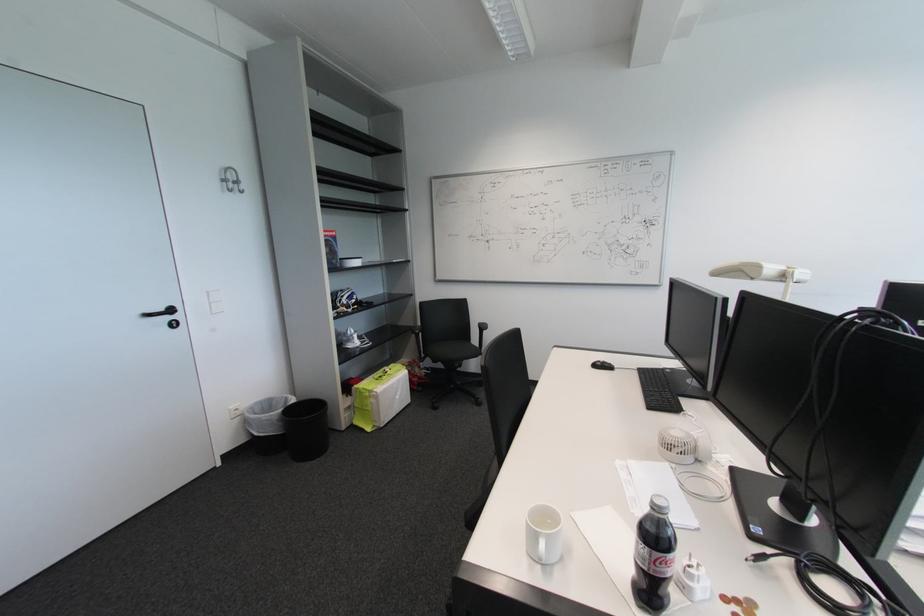
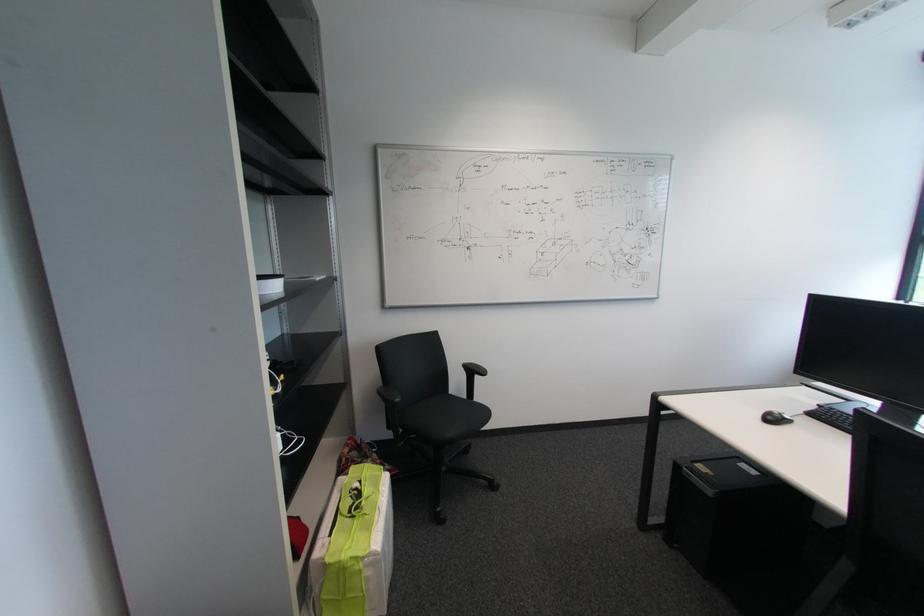
Where in the second image is the point corresponding to (x=378, y=405) from the first image?

(372, 581)